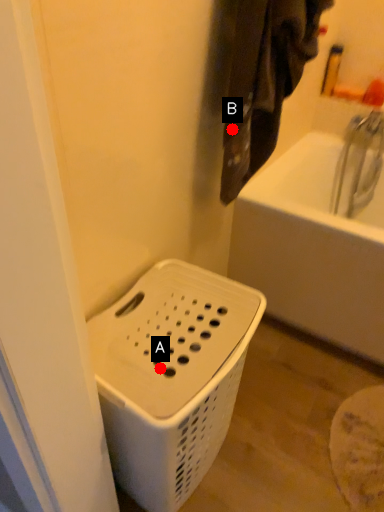
Question: Two points are circled on the image, labeled by A and B beside each circle. Which point is farther from the camera taking this photo?

Choices:
 (A) A is further
 (B) B is further

Answer: (B)